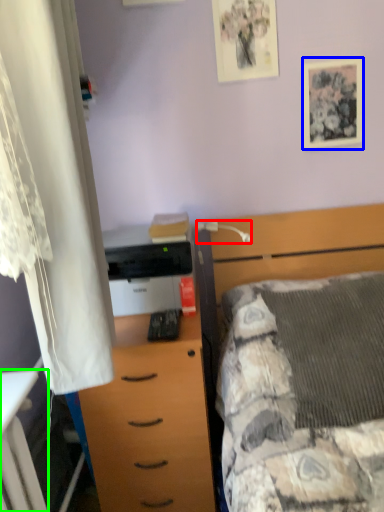
Question: Estimate the real-world distances between objects in this image. Which object is farther from lamp (highlighted by a red box), picture frame (highlighted by a blue box) or desk (highlighted by a green box)?

Choices:
 (A) picture frame
 (B) desk

Answer: (B)